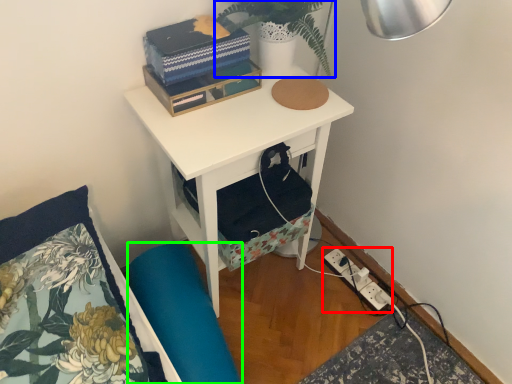
Question: Which object is the closest to the electric outlet (highlighted by a red box)? Choose among these: plant (highlighted by a blue box) or swivel chair (highlighted by a green box).

Choices:
 (A) plant
 (B) swivel chair

Answer: (B)